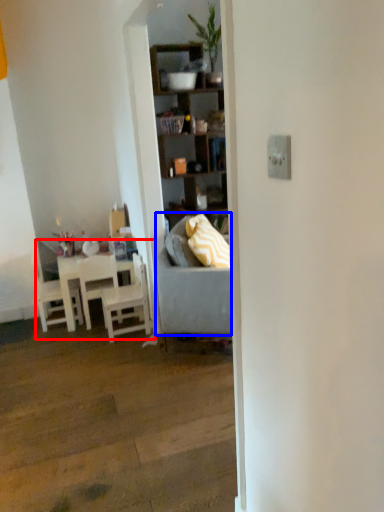
Question: Which point is further to the camera, kitchen & dining room table (highlighted by a red box) or studio couch (highlighted by a blue box)?

Choices:
 (A) kitchen & dining room table
 (B) studio couch

Answer: (A)